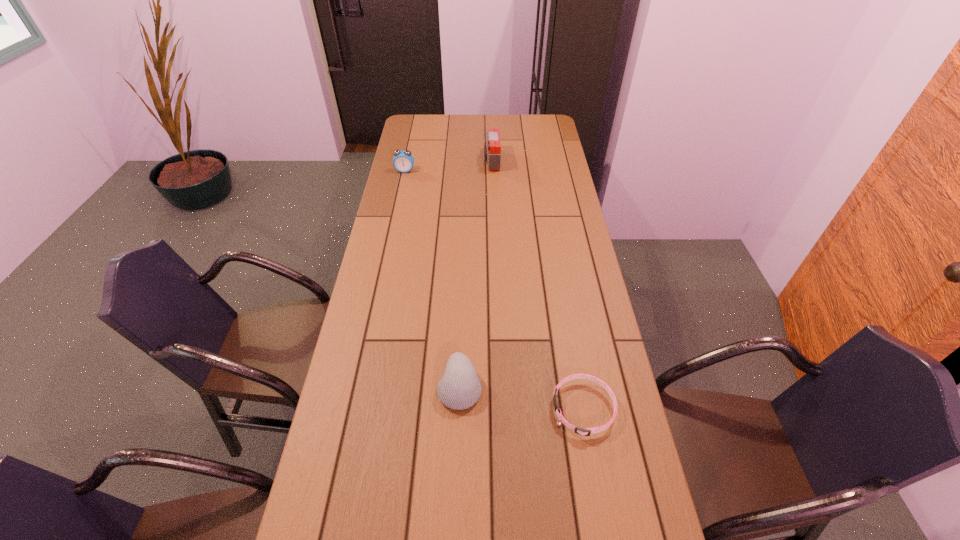
Locate an element on the screen. vacant space located on the right of the beanie is located at coordinates (589, 387).

You are a GUI agent. You are given a task and a screenshot of the screen. Output one action in this format:
    pyautogui.click(x=<x>, y=<y>)
    Task: Click on the free space located 0.390m with the buckle on the rightmost object
    The width and height of the screenshot is (960, 540).
    Given the screenshot: What is the action you would take?
    pyautogui.click(x=402, y=409)

The height and width of the screenshot is (540, 960). What are the coordinates of `vacant area situated with the buckle on the rightmost object` in the screenshot? It's located at coord(499,409).

Find the location of `vacant space located 0.160m with the buckle on the rightmost object`. vacant space located 0.160m with the buckle on the rightmost object is located at coordinates (492, 409).

This screenshot has width=960, height=540. I want to click on object at the left edge, so click(x=403, y=161).

The image size is (960, 540). I want to click on object that is at the right edge, so click(586, 431).

Locate an element on the screen. free space at the far edge of the desktop is located at coordinates (471, 117).

Where is `free space at the left edge of the desktop`? free space at the left edge of the desktop is located at coordinates (357, 346).

In the image, there is a desktop. At what (x,y) coordinates should I click in order to perform the action: click on vacant area at the right edge. Please return your answer as a coordinate pair (x, y). The width and height of the screenshot is (960, 540). Looking at the image, I should click on (541, 149).

Where is `unoccupied position between the leftmost object and the camera`? The image size is (960, 540). unoccupied position between the leftmost object and the camera is located at coordinates (448, 166).